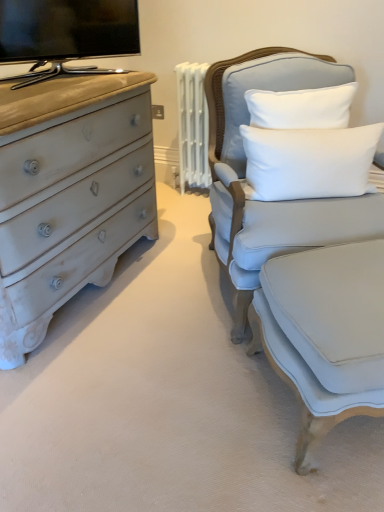
This screenshot has height=512, width=384. I want to click on white soft cushion at upper right, so click(x=309, y=161).

At what (x,y) coordinates should I click in order to perform the action: click on light gray fabric chair at right. Please return your answer as a coordinate pair (x, y). This screenshot has width=384, height=512. Looking at the image, I should click on (245, 170).

This screenshot has width=384, height=512. What do you see at coordinates (245, 170) in the screenshot?
I see `light gray fabric chair at right` at bounding box center [245, 170].

What do you see at coordinates (66, 32) in the screenshot? I see `flat-screen tv at upper left` at bounding box center [66, 32].

Measure the distance between flat-screen tv at upper left and camera.

They are 1.60 meters apart.

The height and width of the screenshot is (512, 384). What do you see at coordinates (324, 334) in the screenshot?
I see `light blue fabric swivel chair at right` at bounding box center [324, 334].

The image size is (384, 512). In order to click on white soft cushion at upper right in this screenshot , I will do `click(309, 161)`.

Is white soft cushion at upper right positioned with its back to light blue fabric swivel chair at right?

No, white soft cushion at upper right is not facing the opposite direction of light blue fabric swivel chair at right.

From a real-world perspective, is white soft cushion at upper right on light blue fabric swivel chair at right?

Correct, in the physical world, white soft cushion at upper right is higher than light blue fabric swivel chair at right.

From the image's perspective, would you say white soft cushion at upper right is positioned over light blue fabric swivel chair at right?

Indeed, from the image's perspective, white soft cushion at upper right is shown above light blue fabric swivel chair at right.

From the image's perspective, does white soft cushion at upper right appear lower than light gray fabric chair at right?

No.

Is white soft cushion at upper right inside or outside of light gray fabric chair at right?

white soft cushion at upper right exists entirely within light gray fabric chair at right.

From a real-world perspective, which is physically above, white soft cushion at upper right or light gray fabric chair at right?

white soft cushion at upper right.

Is white soft cushion at upper right taller than light gray fabric chair at right?

In fact, white soft cushion at upper right may be shorter than light gray fabric chair at right.

From a real-world perspective, relative to light blue fabric swivel chair at right, is light gray fabric chair at right vertically above or below?

From a real-world perspective, light gray fabric chair at right is physically above light blue fabric swivel chair at right.

Which object is thinner, light gray fabric chair at right or light blue fabric swivel chair at right?

light blue fabric swivel chair at right is thinner.

Considering the sizes of light gray fabric chair at right and light blue fabric swivel chair at right in the image, is light gray fabric chair at right taller or shorter than light blue fabric swivel chair at right?

Clearly, light gray fabric chair at right is taller compared to light blue fabric swivel chair at right.

Which point is more distant from viewer, (335, 82) or (336, 253)?

Positioned behind is point (335, 82).

Is light blue fabric swivel chair at right wider than light gray fabric chair at right?

No.

Is light blue fabric swivel chair at right positioned far away from light gray fabric chair at right?

No, light blue fabric swivel chair at right is not far away from light gray fabric chair at right.

Choose the correct answer: Is light blue fabric swivel chair at right inside light gray fabric chair at right or outside it?

light blue fabric swivel chair at right is spatially situated outside light gray fabric chair at right.

Which is closer to the camera, (270, 337) or (13, 78)?

Point (270, 337)

What are the coordinates of `swivel chair beneath the flat-screen tv at upper left (from a real-world perspective)` in the screenshot? It's located at (324, 334).

Is light blue fabric swivel chair at right oriented towards flat-screen tv at upper left?

No, light blue fabric swivel chair at right does not turn towards flat-screen tv at upper left.

Considering the positions of objects light blue fabric swivel chair at right and flat-screen tv at upper left in the image provided, who is more to the left, light blue fabric swivel chair at right or flat-screen tv at upper left?

From the viewer's perspective, flat-screen tv at upper left appears more on the left side.

Is light gray fabric chair at right smaller than flat-screen tv at upper left?

No, light gray fabric chair at right is not smaller than flat-screen tv at upper left.

Is light gray fabric chair at right in contact with flat-screen tv at upper left?

There is a gap between light gray fabric chair at right and flat-screen tv at upper left.

How many degrees apart are the facing directions of light gray fabric chair at right and flat-screen tv at upper left?

The facing directions of light gray fabric chair at right and flat-screen tv at upper left are 17.9 degrees apart.

From the image's perspective, would you say light gray fabric chair at right is shown under flat-screen tv at upper left?

Yes, from the image's perspective, light gray fabric chair at right is below flat-screen tv at upper left.

Is point (311, 365) closer to viewer compared to point (298, 174)?

Yes, point (311, 365) is in front of point (298, 174).

From a real-world perspective, between light blue fabric swivel chair at right and white soft cushion at upper right, who is vertically lower?

From a 3D spatial view, light blue fabric swivel chair at right is below.

Is light blue fabric swivel chair at right further to camera compared to white soft cushion at upper right?

No.

Considering the sizes of light blue fabric swivel chair at right and white soft cushion at upper right in the image, is light blue fabric swivel chair at right taller or shorter than white soft cushion at upper right?

Considering their sizes, light blue fabric swivel chair at right has more height than white soft cushion at upper right.

Identify the location of pillow that is above the light blue fabric swivel chair at right (from the image's perspective). The image size is (384, 512). (309, 161).

At what (x,y) coordinates should I click in order to perform the action: click on chair below the white soft cushion at upper right (from the image's perspective). Please return your answer as a coordinate pair (x, y). Looking at the image, I should click on (245, 170).

Which object lies nearer to the anchor point flat-screen tv at upper left, white soft cushion at upper right or light gray fabric chair at right?

Based on the image, light gray fabric chair at right appears to be nearer to flat-screen tv at upper left.

Which object lies nearer to the anchor point white soft cushion at upper right, light blue fabric swivel chair at right or light gray fabric chair at right?

The object closer to white soft cushion at upper right is light gray fabric chair at right.

From the image, which object appears to be farther from light blue fabric swivel chair at right, flat-screen tv at upper left or white soft cushion at upper right?

Among the two, flat-screen tv at upper left is located further to light blue fabric swivel chair at right.

When comparing their distances from light blue fabric swivel chair at right, does flat-screen tv at upper left or light gray fabric chair at right seem further?

flat-screen tv at upper left is positioned further to the anchor light blue fabric swivel chair at right.

From the image, which object appears to be farther from white soft cushion at upper right, flat-screen tv at upper left or light blue fabric swivel chair at right?

Based on the image, flat-screen tv at upper left appears to be further to white soft cushion at upper right.

Based on their spatial positions, is light gray fabric chair at right or white soft cushion at upper right further from light blue fabric swivel chair at right?

Based on the image, white soft cushion at upper right appears to be further to light blue fabric swivel chair at right.

Estimate the real-world distances between objects in this image. Which object is further from light blue fabric swivel chair at right, light gray fabric chair at right or flat-screen tv at upper left?

flat-screen tv at upper left lies further to light blue fabric swivel chair at right than the other object.

Which object lies further to the anchor point flat-screen tv at upper left, light gray fabric chair at right or white soft cushion at upper right?

white soft cushion at upper right is further to flat-screen tv at upper left.

The height and width of the screenshot is (512, 384). I want to click on chair between white soft cushion at upper right and light blue fabric swivel chair at right in the vertical direction, so click(245, 170).

Locate an element on the screen. The width and height of the screenshot is (384, 512). pillow between flat-screen tv at upper left and light blue fabric swivel chair at right in the horizontal direction is located at coordinates (309, 161).

Where is `chair between flat-screen tv at upper left and white soft cushion at upper right from left to right`? This screenshot has height=512, width=384. chair between flat-screen tv at upper left and white soft cushion at upper right from left to right is located at coordinates (245, 170).

Identify the location of chair between flat-screen tv at upper left and light blue fabric swivel chair at right in the vertical direction. Image resolution: width=384 pixels, height=512 pixels. (245, 170).